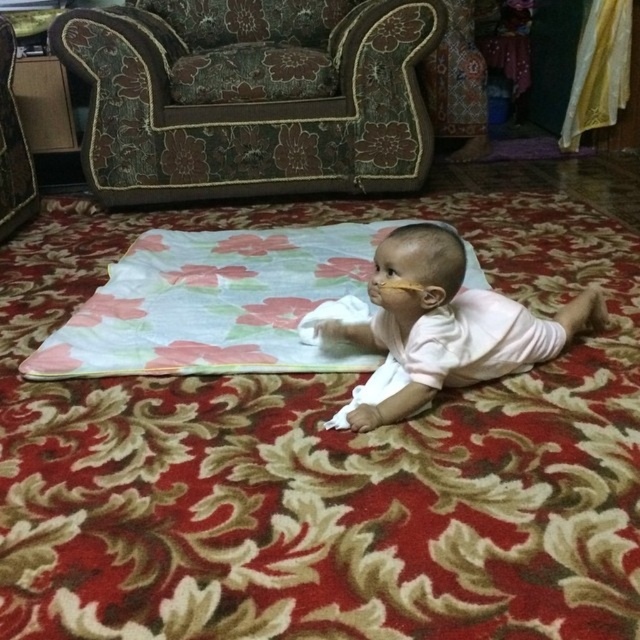
Question: Does floral fabric armchair at upper left appear under pink smooth baby at center?

Choices:
 (A) no
 (B) yes

Answer: (A)

Question: Which object is farther from the camera taking this photo?

Choices:
 (A) floral fabric blanket at center
 (B) pink smooth baby at center
 (C) floral fabric mat at center

Answer: (A)

Question: Among these objects, which one is nearest to the camera?

Choices:
 (A) floral fabric blanket at center
 (B) floral fabric armchair at upper left
 (C) white soft diaper at center

Answer: (A)

Question: Where is floral fabric mat at center located in relation to white soft diaper at center in the image?

Choices:
 (A) right
 (B) left

Answer: (A)

Question: Which point appears closest to the camera in this image?

Choices:
 (A) (154, 243)
 (B) (90, 76)
 (C) (577, 602)

Answer: (C)

Question: Is floral fabric mat at center smaller than floral fabric blanket at center?

Choices:
 (A) no
 (B) yes

Answer: (A)